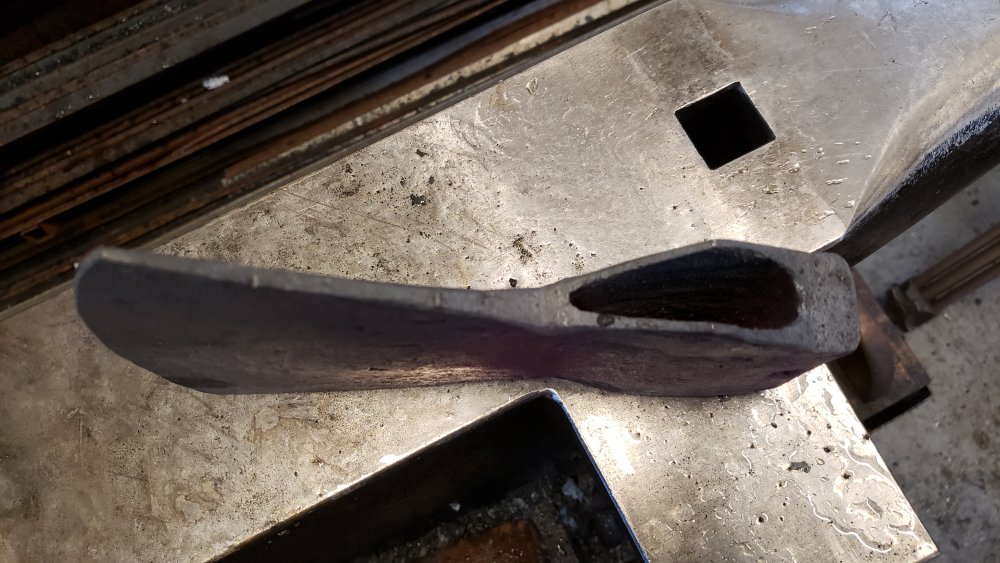
Where is `frame`? This screenshot has width=1000, height=563. frame is located at coordinates (264, 91).